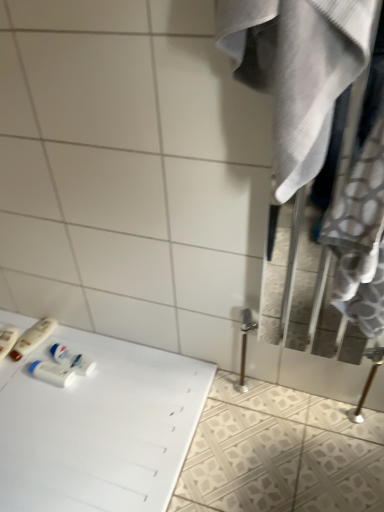
Question: Is white glossy table at lower left to the right of white fabric closet at right from the viewer's perspective?

Choices:
 (A) yes
 (B) no

Answer: (B)

Question: From the image's perspective, is white glossy table at lower left located above white fabric closet at right?

Choices:
 (A) no
 (B) yes

Answer: (A)

Question: Can you confirm if white glossy table at lower left is thinner than white fabric closet at right?

Choices:
 (A) no
 (B) yes

Answer: (A)

Question: From a real-world perspective, is white glossy table at lower left under white fabric closet at right?

Choices:
 (A) yes
 (B) no

Answer: (A)

Question: Does white glossy table at lower left have a larger size compared to white fabric closet at right?

Choices:
 (A) yes
 (B) no

Answer: (A)

Question: Considering the positions of white plastic tube at lower left, the 3th toiletry when ordered from left to right, and white glossy table at lower left in the image, is white plastic tube at lower left, the 3th toiletry when ordered from left to right, bigger or smaller than white glossy table at lower left?

Choices:
 (A) big
 (B) small

Answer: (B)

Question: In terms of width, does white plastic tube at lower left, the 3th toiletry when ordered from left to right, look wider or thinner when compared to white glossy table at lower left?

Choices:
 (A) thin
 (B) wide

Answer: (A)

Question: From the image's perspective, is white plastic tube at lower left, the 3th toiletry when ordered from left to right, above or below white glossy table at lower left?

Choices:
 (A) below
 (B) above

Answer: (B)

Question: From their relative heights in the image, would you say white plastic tube at lower left, which is the 1th toiletry from right to left, is taller or shorter than white glossy table at lower left?

Choices:
 (A) tall
 (B) short

Answer: (A)

Question: Is matte plastic toothbrush at lower left, the first toiletry in the left-to-right sequence, wider or thinner than white plastic mouthwash at lower left?

Choices:
 (A) thin
 (B) wide

Answer: (B)

Question: Is matte plastic toothbrush at lower left, acting as the 3th toiletry starting from the right, inside the boundaries of white plastic mouthwash at lower left, or outside?

Choices:
 (A) outside
 (B) inside

Answer: (A)

Question: Based on their sizes in the image, would you say matte plastic toothbrush at lower left, the first toiletry in the left-to-right sequence, is bigger or smaller than white plastic mouthwash at lower left?

Choices:
 (A) big
 (B) small

Answer: (A)

Question: Is matte plastic toothbrush at lower left, acting as the 3th toiletry starting from the right, in front of or behind white plastic mouthwash at lower left in the image?

Choices:
 (A) front
 (B) behind

Answer: (B)

Question: Visually, is white glossy table at lower left positioned to the left or to the right of white fabric closet at right?

Choices:
 (A) left
 (B) right

Answer: (A)

Question: Is white glossy table at lower left inside or outside of white fabric closet at right?

Choices:
 (A) outside
 (B) inside

Answer: (A)